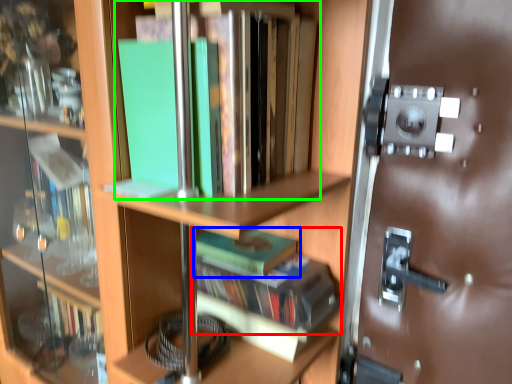
Question: Considering the real-world distances, which object is closest to book (highlighted by a red box)? book (highlighted by a blue box) or book (highlighted by a green box).

Choices:
 (A) book
 (B) book

Answer: (A)